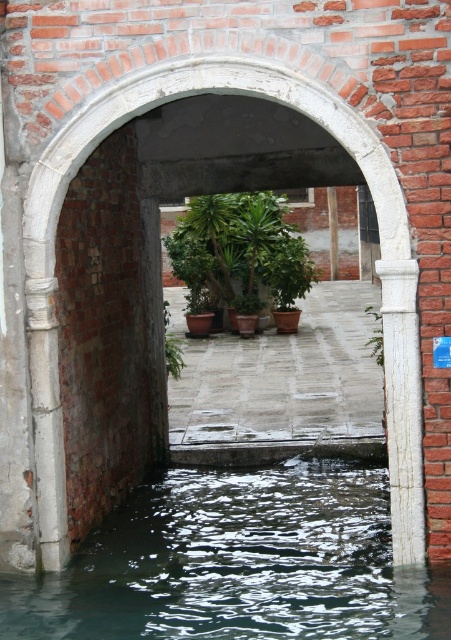
Is green matte plant at center below white marble pillar at right?

No.

Can you confirm if green matte plant at center is positioned to the right of white marble pillar at right?

No, green matte plant at center is not to the right of white marble pillar at right.

Who is more distant from viewer, [262,204] or [420,449]?

Positioned behind is point [262,204].

The image size is (451, 640). What are the coordinates of `green matte plant at center` in the screenshot? It's located at (239, 253).

Between dark green water at center and green leafy plant at center, which one has less height?

Standing shorter between the two is dark green water at center.

Is dark green water at center further to camera compared to green leafy plant at center?

No, dark green water at center is in front of green leafy plant at center.

Between point (207, 586) and point (374, 333), which one is positioned in front?

Point (207, 586)

Locate an element on the screen. The width and height of the screenshot is (451, 640). dark green water at center is located at coordinates (239, 563).

Is white marble pillar at right above green leafy plant at center?

Incorrect, white marble pillar at right is not positioned above green leafy plant at center.

Who is more forward, (x=400, y=412) or (x=372, y=314)?

Point (x=400, y=412)

This screenshot has width=451, height=640. I want to click on white marble pillar at right, so click(x=403, y=406).